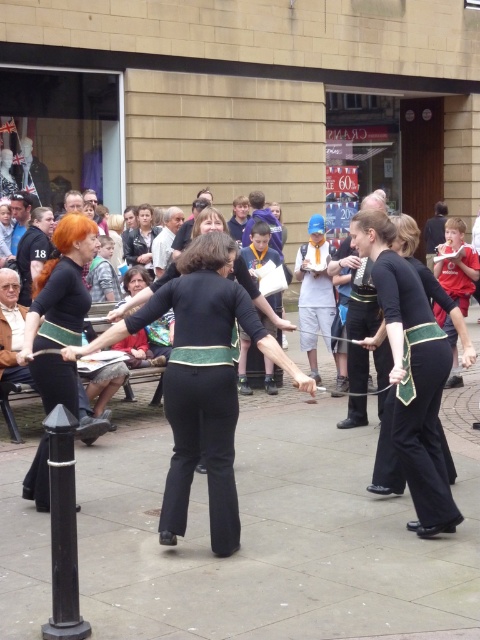
Which is more to the left, black matte pants at center or matte black pants at center?

Positioned to the left is black matte pants at center.

Who is more forward, (x=204, y=296) or (x=394, y=250)?

Point (x=204, y=296)

Locate an element on the screen. This screenshot has width=480, height=640. black matte pants at center is located at coordinates (202, 385).

Find the location of a particular element. black matte pants at center is located at coordinates (202, 385).

Is black matte pants at center further to camera compared to matte black jacket at center?

That is False.

Does black matte pants at center lie in front of matte black jacket at center?

Yes, it is.

Who is more distant from viewer, (x=177, y=404) or (x=148, y=252)?

Point (x=148, y=252)

Identify the location of black matte pants at center. (202, 385).

Which is in front, point (447, 525) or point (36, 323)?

Positioned in front is point (447, 525).

The height and width of the screenshot is (640, 480). I want to click on matte black pants at center, so click(411, 371).

This screenshot has width=480, height=640. Describe the element at coordinates (411, 371) in the screenshot. I see `matte black pants at center` at that location.

Find the location of `matte black pants at center`. matte black pants at center is located at coordinates (411, 371).